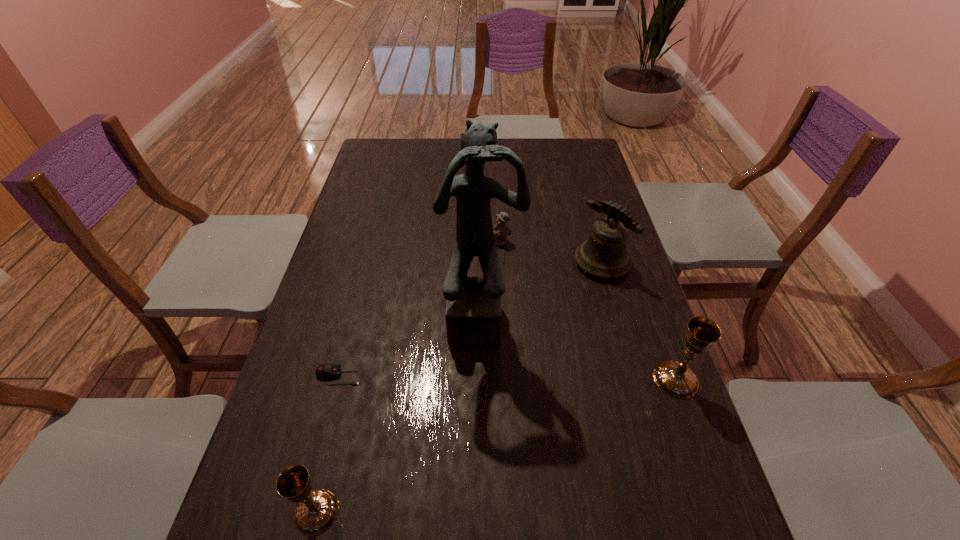
You are a GUI agent. You are given a task and a screenshot of the screen. Output one action in this format:
    pyautogui.click(x=<x>, y=<y>)
    Task: Click on the spot to insert another chalice for uniform distribution
    
    Given the screenshot: What is the action you would take?
    pyautogui.click(x=516, y=438)